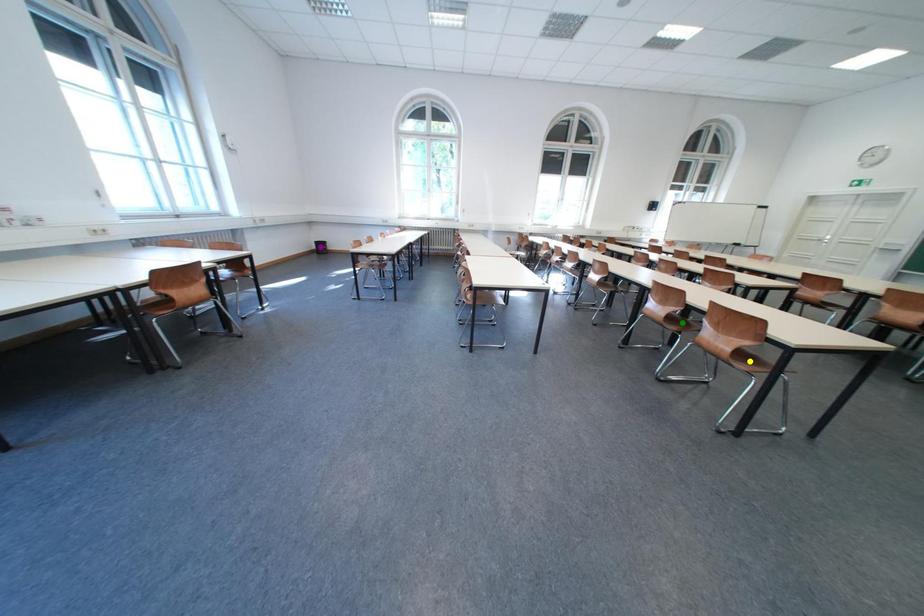
Order these from farthest to nearest:
A) purple point
B) green point
C) yellow point

purple point
green point
yellow point